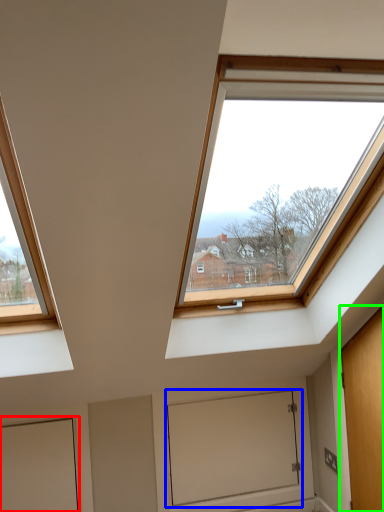
Question: Which object is positioned closest to door (highlighted by a red box)? Select from window screen (highlighted by a blue box) and door (highlighted by a green box).

Choices:
 (A) window screen
 (B) door

Answer: (A)